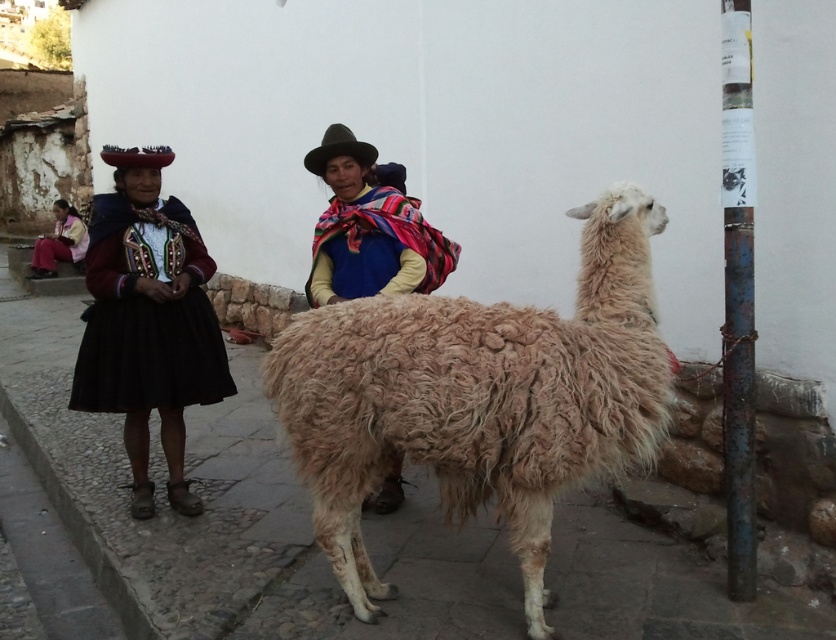
Question: Does fuzzy beige alpaca at center have a larger size compared to multicolored woven shawl at center?

Choices:
 (A) yes
 (B) no

Answer: (A)

Question: Which point appears closest to the camera in this image?

Choices:
 (A) (390, 472)
 (B) (141, 339)
 (C) (345, 134)
 (D) (467, 448)

Answer: (D)

Question: Which of the following is the farthest from the observer?

Choices:
 (A) multicolored woven shawl at center
 (B) black velvet dress at left
 (C) fuzzy beige alpaca at center

Answer: (B)

Question: Does fuzzy beige alpaca at center come behind multicolored woven shawl at center?

Choices:
 (A) no
 (B) yes

Answer: (A)

Question: Is black velvet dress at left smaller than multicolored woven shawl at center?

Choices:
 (A) no
 (B) yes

Answer: (A)

Question: Estimate the real-world distances between objects in this image. Which object is farther from the multicolored woven shawl at center?

Choices:
 (A) brown felt cowboy hat at center
 (B) black velvet dress at left

Answer: (B)